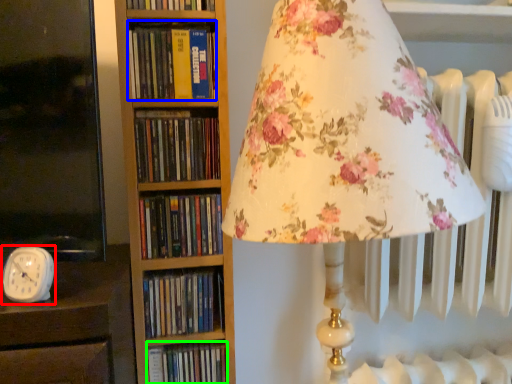
Question: Based on their relative distances, which object is farther from clock (highlighted by a red box)? Choose from book (highlighted by a blue box) and book (highlighted by a green box).

Choices:
 (A) book
 (B) book

Answer: (A)